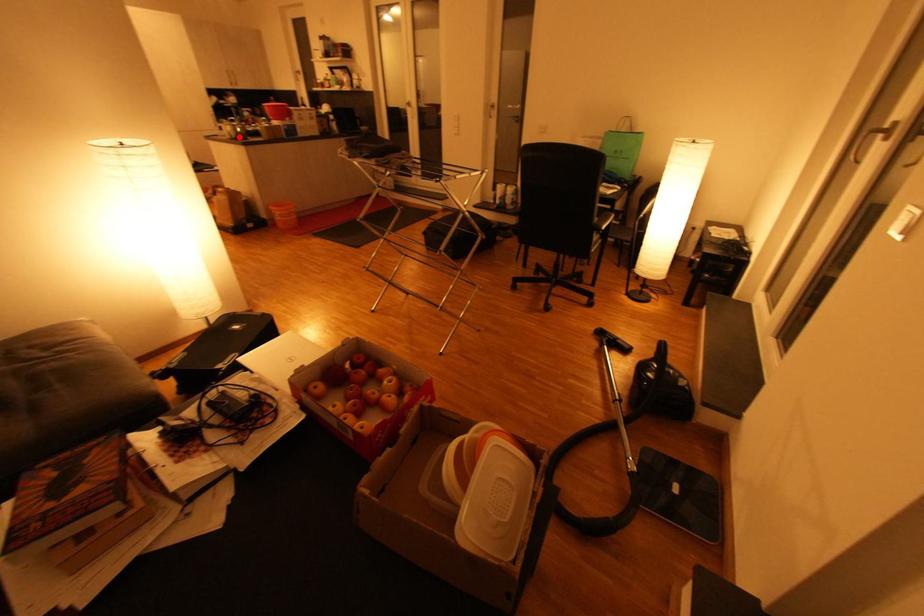
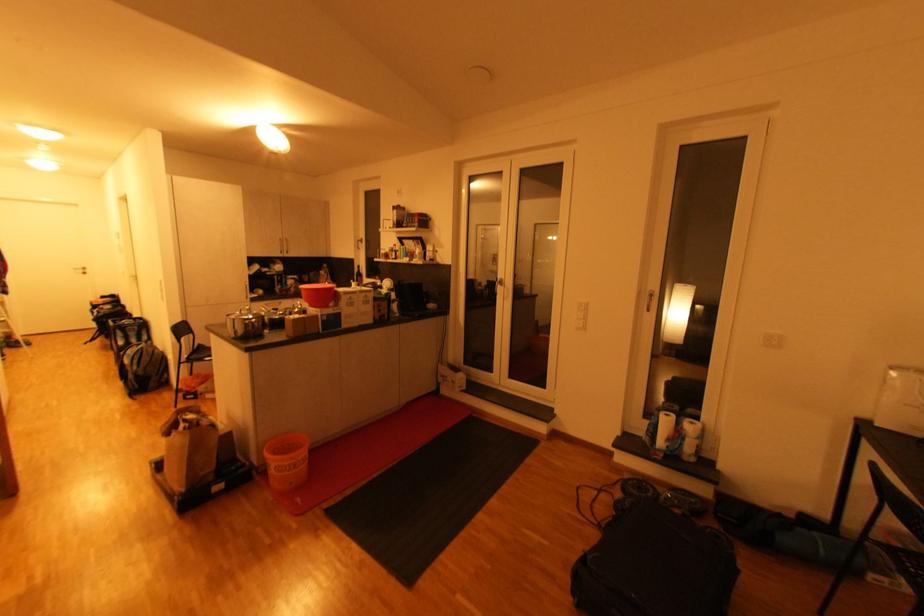
Where in the second image is the point corresponding to the highlighted location from the first image?

(245, 334)